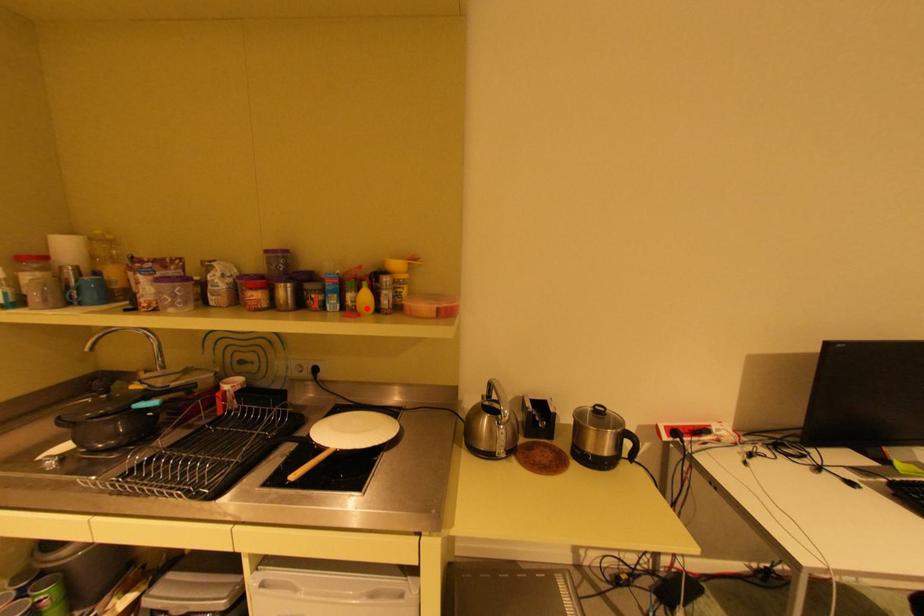
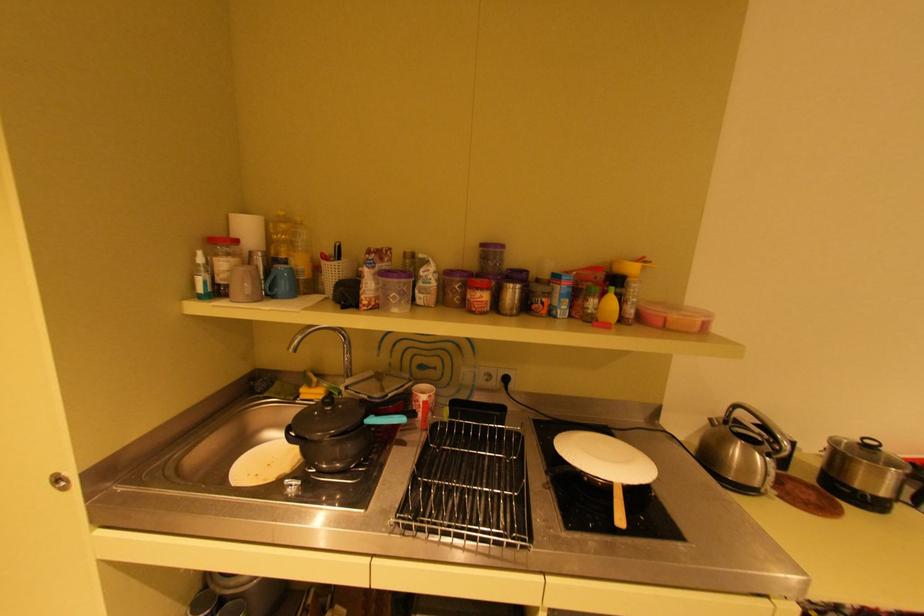
In the second image, find the point that corresponds to the highlighted location in the first image.

(611, 318)